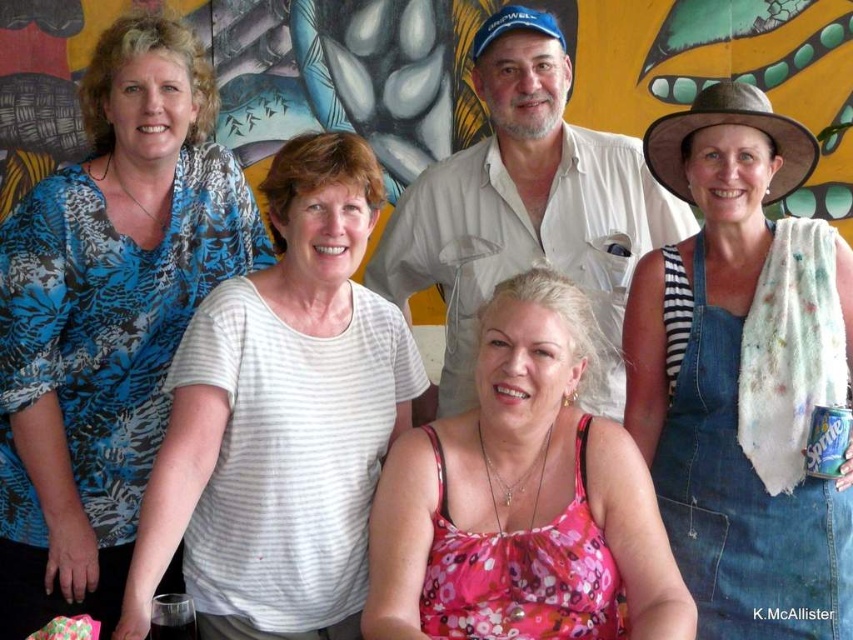
You are standing at the origin point in the image. There are two points marked as point 1 at coordinates point (682, 128) and point 2 at coordinates point (509, 344). Which point is further away from you?

Point 1 at coordinates point (682, 128) is further away from you than point 2 at coordinates point (509, 344).

You are a photographer trying to capture a closeup of the blue printed blouse at upper left and the white striped shirt at upper left. Since you can only focus on one at a time, which one would you choose to ensure it fits entirely within your camera frame?

The blue printed blouse at upper left has a lesser width compared to the white striped shirt at upper left, so you should focus on the white striped shirt at upper left to ensure it fits entirely within your camera frame.